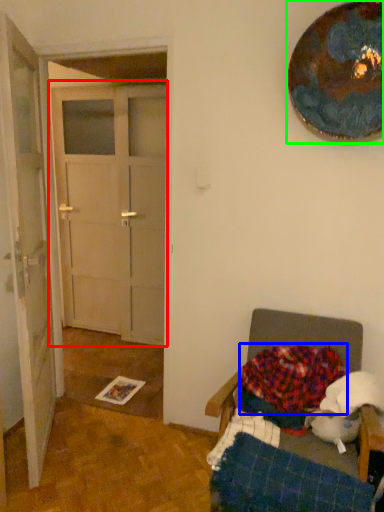
Question: Based on their relative distances, which object is nearer to door (highlighted by a red box)? Choose from blanket (highlighted by a blue box) and oval (highlighted by a green box).

Choices:
 (A) blanket
 (B) oval

Answer: (A)